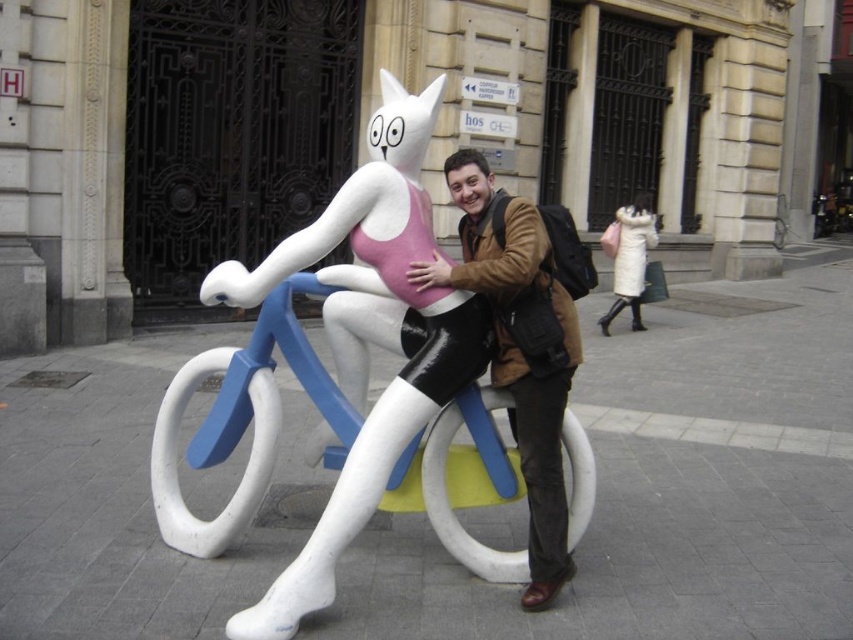
Between brown leather jacket at center and white fur coat at upper right, which one is positioned higher?

white fur coat at upper right

Between point (544, 544) and point (637, 317), which one is positioned behind?

The point (637, 317) is more distant.

Locate an element on the screen. brown leather jacket at center is located at coordinates (519, 346).

Who is lower down, white matte cat at center or brown leather jacket at center?

white matte cat at center is below.

Where is `white matte cat at center`? The image size is (853, 640). white matte cat at center is located at coordinates (451, 397).

Does white matte cat at center have a lesser width compared to white fur coat at upper right?

In fact, white matte cat at center might be wider than white fur coat at upper right.

Is white matte cat at center shorter than white fur coat at upper right?

No, white matte cat at center is not shorter than white fur coat at upper right.

Locate an element on the screen. white matte cat at center is located at coordinates (451, 397).